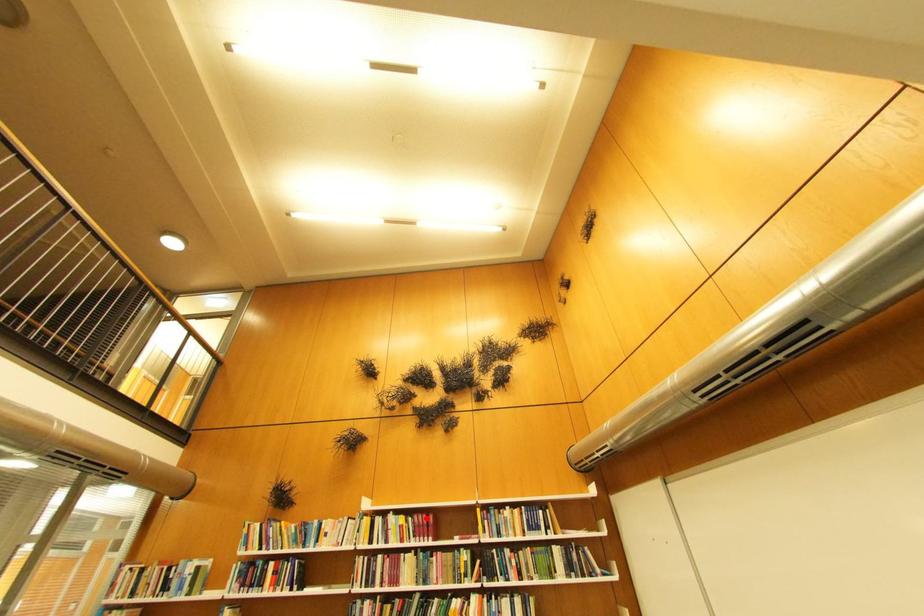
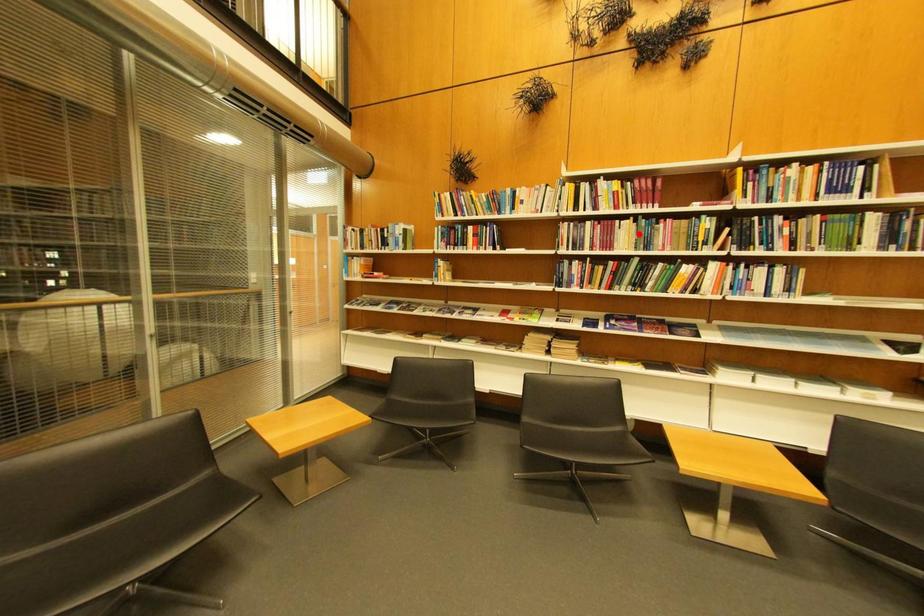
I am providing you with two images of the same scene from different viewpoints. A red point is marked on the first image and another point is marked on the second image. Is the marked point in image1 the same physical position as the marked point in image2?

No